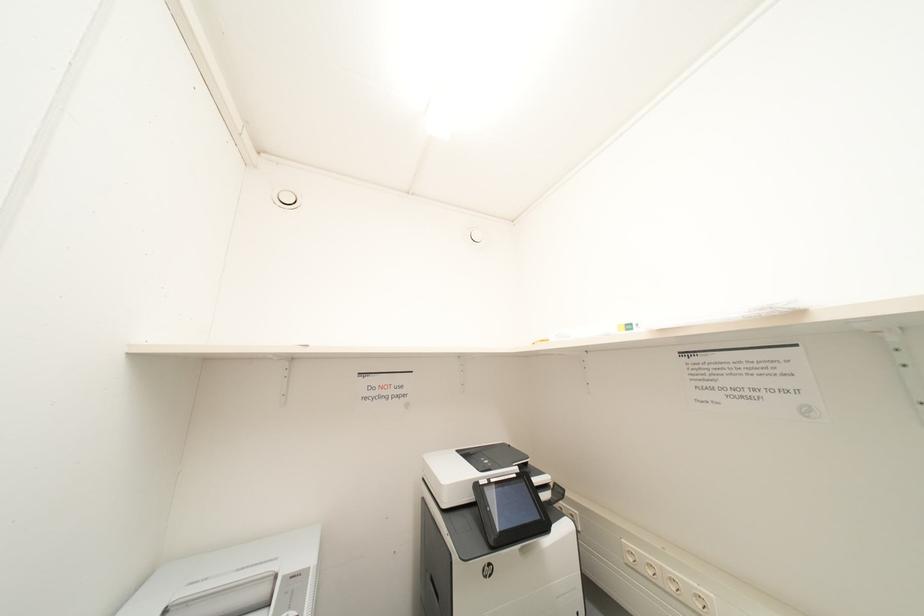
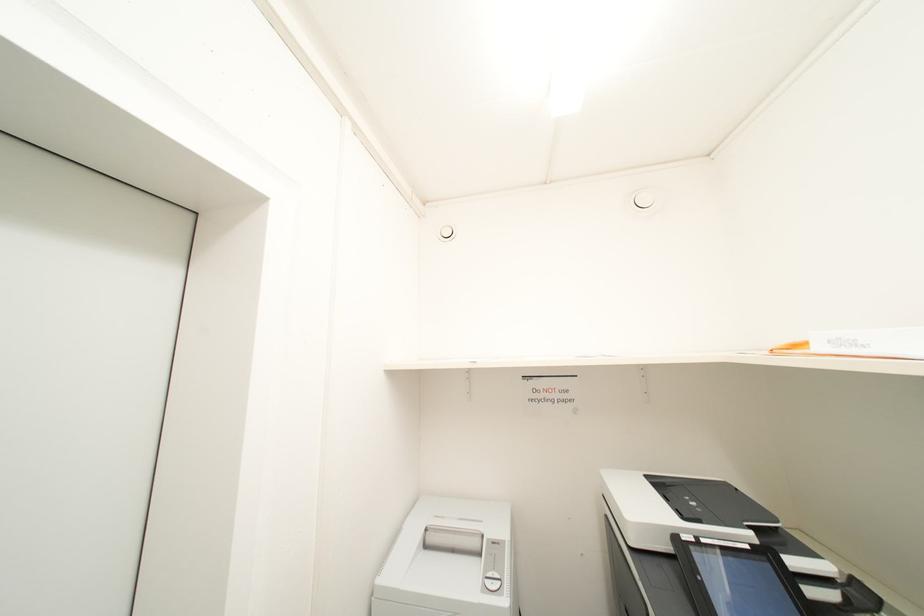
Question: The camera is either moving clockwise (left) or counter-clockwise (right) around the object. The first image is from the beginning of the video and the second image is from the end. Is the camera moving left or right when shooting the video?

Choices:
 (A) Left
 (B) Right

Answer: (B)